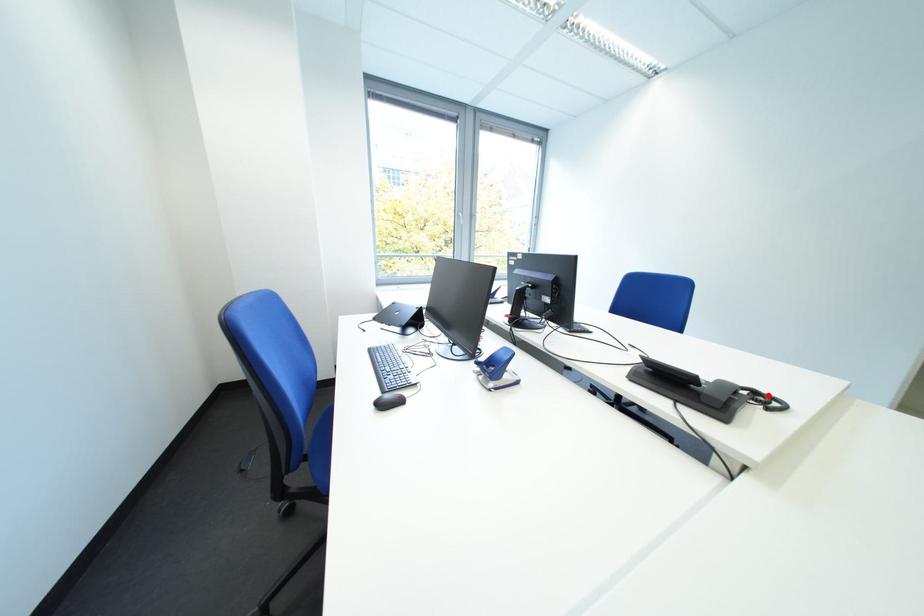
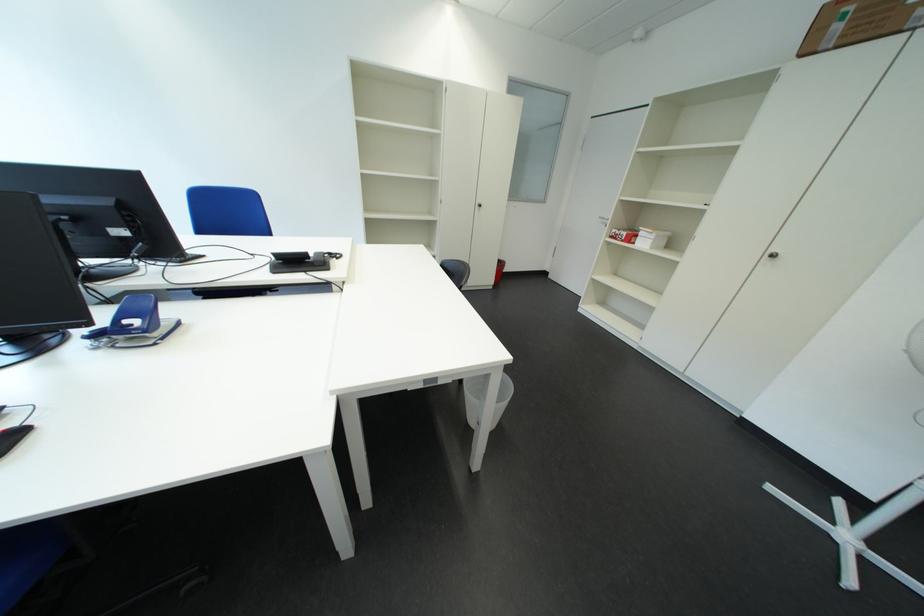
The point at the highlighted location is marked in the first image. Where is the corresponding point in the second image?

(342, 256)